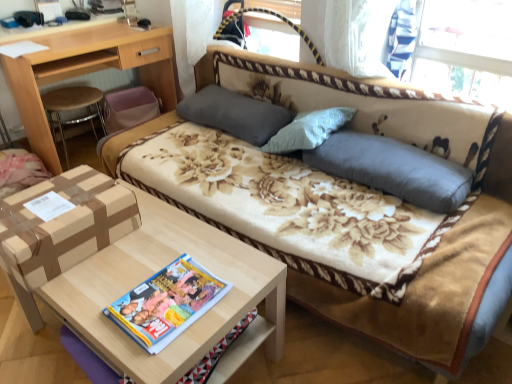
Where is `vacant space underneath multicolored glossy magazine at center (from a real-world perspective)`? vacant space underneath multicolored glossy magazine at center (from a real-world perspective) is located at coordinates (169, 301).